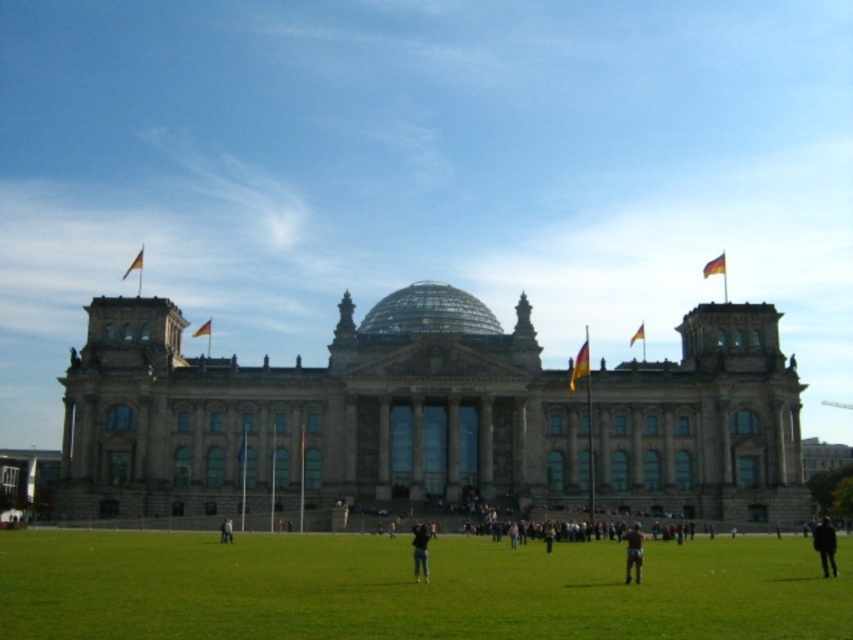
Is transparent glass dome at center to the left of yellow-green fabric flag at center-right from the viewer's perspective?

Yes, transparent glass dome at center is to the left of yellow-green fabric flag at center-right.

Measure the distance from transparent glass dome at center to yellow-green fabric flag at center-right.

23.18 meters

Locate an element on the screen. The image size is (853, 640). transparent glass dome at center is located at coordinates (428, 310).

Does dark gray pants at lower right appear on the left side of yellow-green fabric flag at upper left?

In fact, dark gray pants at lower right is to the right of yellow-green fabric flag at upper left.

Consider the image. Between dark gray pants at lower right and yellow-green fabric flag at upper left, which one appears on the left side from the viewer's perspective?

Positioned to the left is yellow-green fabric flag at upper left.

Is point (819, 540) farther from viewer compared to point (196, 336)?

No, (819, 540) is closer to viewer.

This screenshot has height=640, width=853. What are the coordinates of `dark gray pants at lower right` in the screenshot? It's located at (825, 545).

Can you confirm if dark gray pants at lower right is thinner than blue fabric flag at center?

No, dark gray pants at lower right is not thinner than blue fabric flag at center.

Between dark gray pants at lower right and blue fabric flag at center, which one is positioned higher?

blue fabric flag at center is above.

The height and width of the screenshot is (640, 853). Identify the location of dark gray pants at lower right. (825, 545).